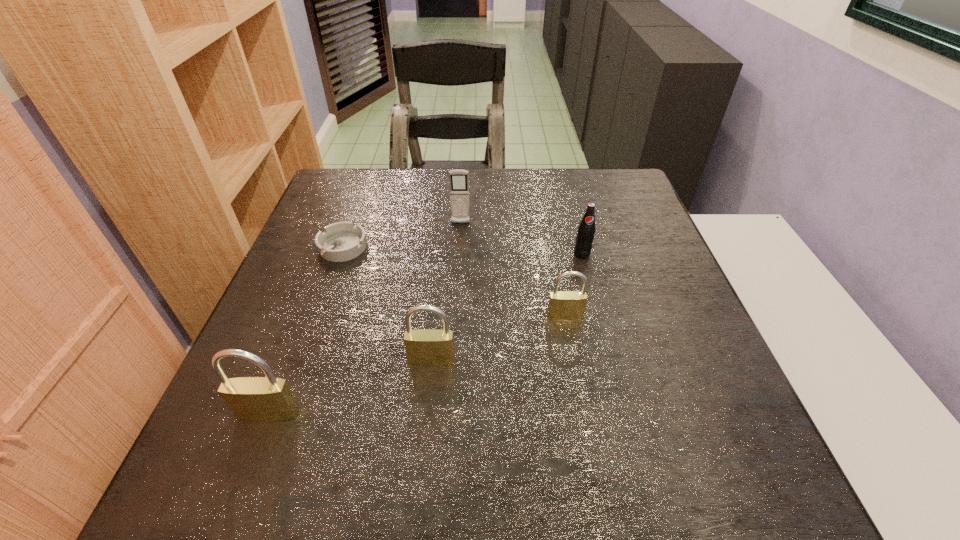
Observe the arrangement of all padlocks in the image. To keep them evenly spaced, where would you place another padlock on the right? Please locate a free space. Please provide its 2D coordinates. Your answer should be formatted as a tuple, i.e. [(x, y)], where the tuple contains the x and y coordinates of a point satisfying the conditions above.

[(677, 279)]